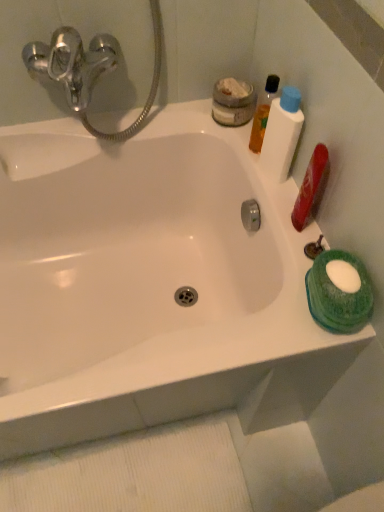
The image size is (384, 512). Find the location of `vacant space positioned to the left of matte gray jar at upper right, placed as the fifth mouthwash when sorted from bottom to top`. vacant space positioned to the left of matte gray jar at upper right, placed as the fifth mouthwash when sorted from bottom to top is located at coordinates (176, 121).